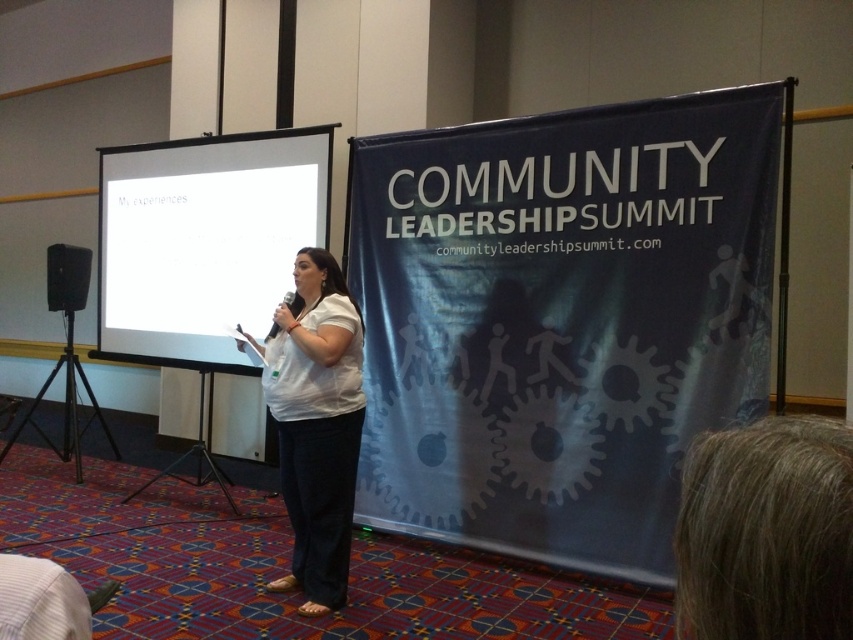
Question: Where is white matte shirt at center located in relation to black matte speaker at left in the image?

Choices:
 (A) below
 (B) above

Answer: (A)

Question: Can you confirm if blue fabric banner at center is positioned to the left of white glossy projection screen at center?

Choices:
 (A) yes
 (B) no

Answer: (B)

Question: Estimate the real-world distances between objects in this image. Which object is farther from the white matte shirt at center?

Choices:
 (A) white glossy projection screen at center
 (B) black matte speaker at left

Answer: (B)

Question: Based on their relative distances, which object is farther from the white matte shirt at center?

Choices:
 (A) white glossy projection screen at center
 (B) blue fabric banner at center
 (C) black matte speaker at left

Answer: (C)

Question: Which point is farther to the camera?

Choices:
 (A) black matte speaker at left
 (B) blue fabric banner at center
 (C) white glossy projection screen at center

Answer: (A)

Question: Does white glossy projection screen at center appear on the left side of white matte shirt at center?

Choices:
 (A) yes
 (B) no

Answer: (A)